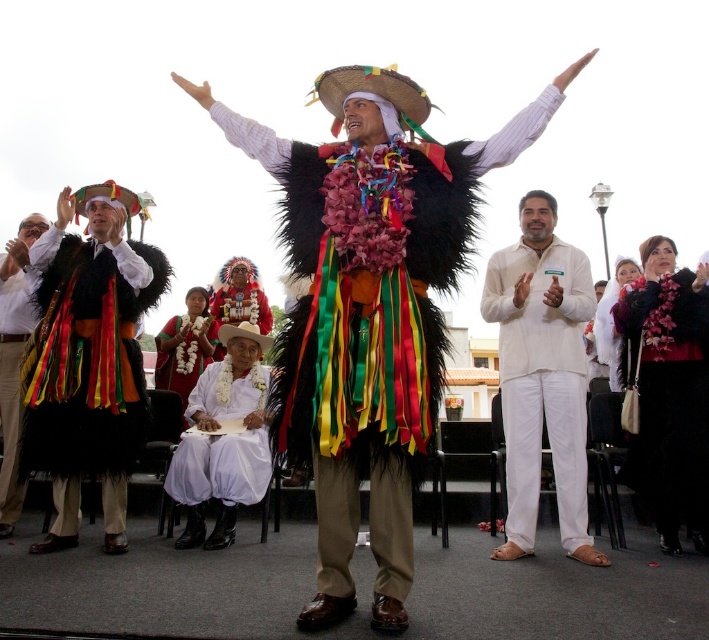
You are an event organizer planning to place a decorative banner between the matte black feathered vest at left and the white fabric at center. Which object should the banner be closer to if you want it positioned near the narrower item?

The matte black feathered vest at left has a lesser width compared to the white fabric at center, so the banner should be placed closer to the matte black feathered vest at left to be near the narrower item.

You are taking a photo of the celebration and want to focus on two specific points in the image. The first point is at coordinate point (679, 442) and the second is at coordinate point (4, 506). Which point will appear closer to the camera in your photo?

Point (679, 442) is closer to the camera than point (4, 506).

You are attending the cultural event and want to take a photo of the white cotton cloth at center and the matte black feathered vest at left. Can you see both items clearly in the same frame?

The white cotton cloth at center is positioned under the matte black feathered vest at left, so the vest may partially block the view of the cloth in the photo.